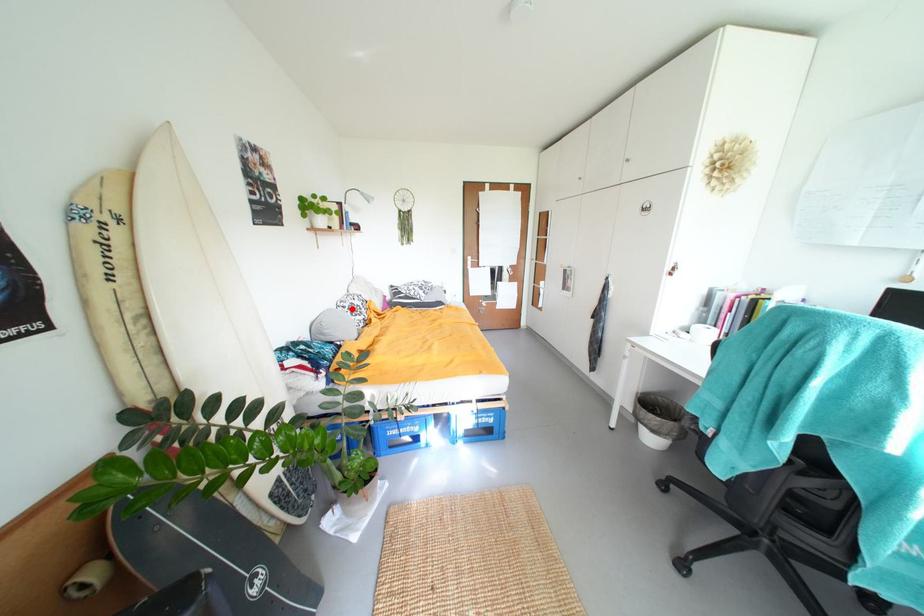
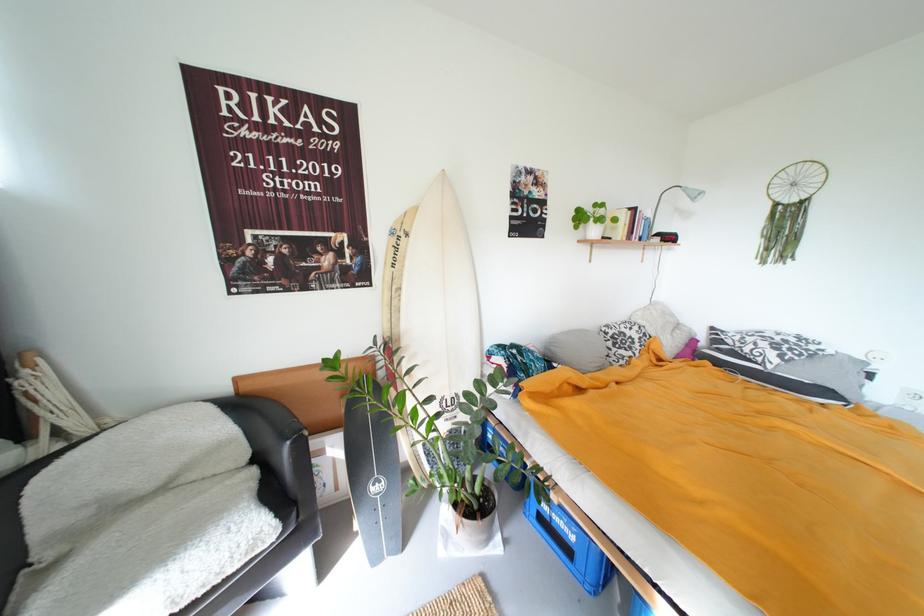
Locate, in the second image, the point that corresponds to the highlighted location in the first image.

(614, 334)